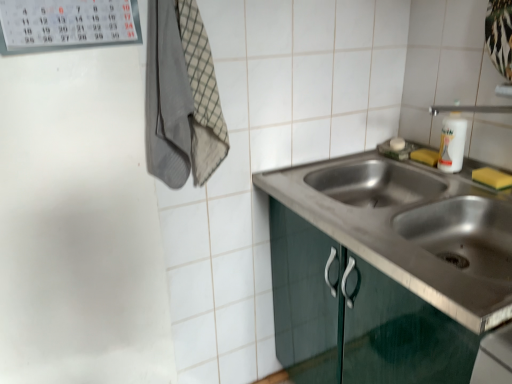
At what (x,y) coordinates should I click in order to perform the action: click on vacant region in front of white glossy bottle at upper right. Please return your answer as a coordinate pair (x, y). The image size is (512, 384). Looking at the image, I should click on (471, 189).